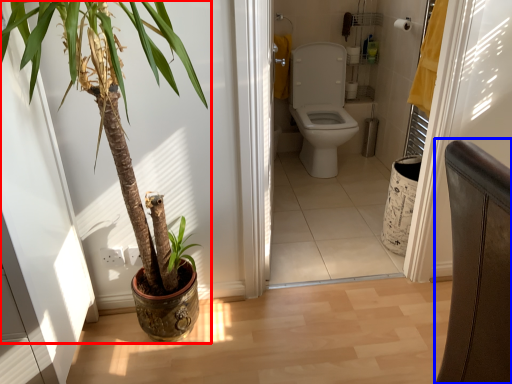
Question: Which object is further to the camera taking this photo, houseplant (highlighted by a red box) or chair (highlighted by a blue box)?

Choices:
 (A) houseplant
 (B) chair

Answer: (A)